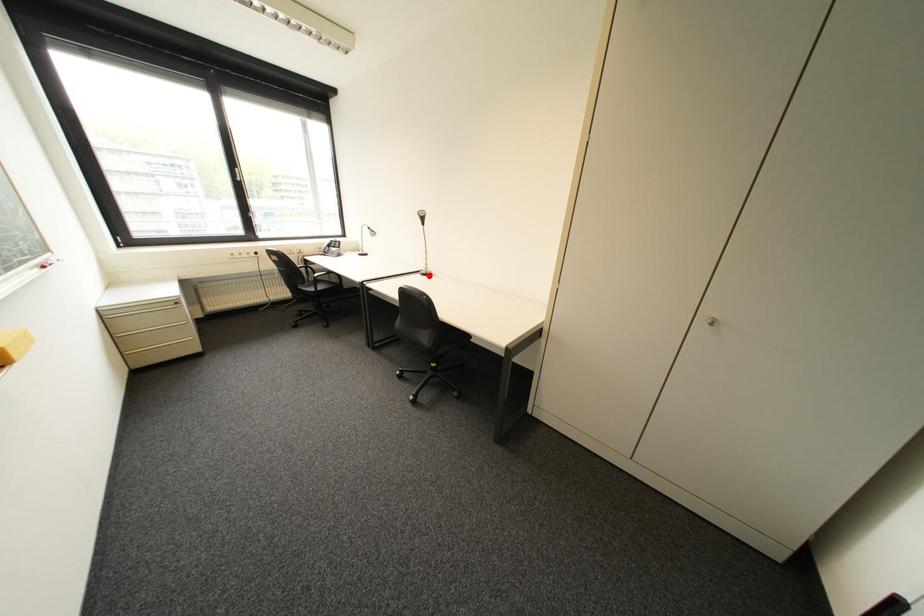
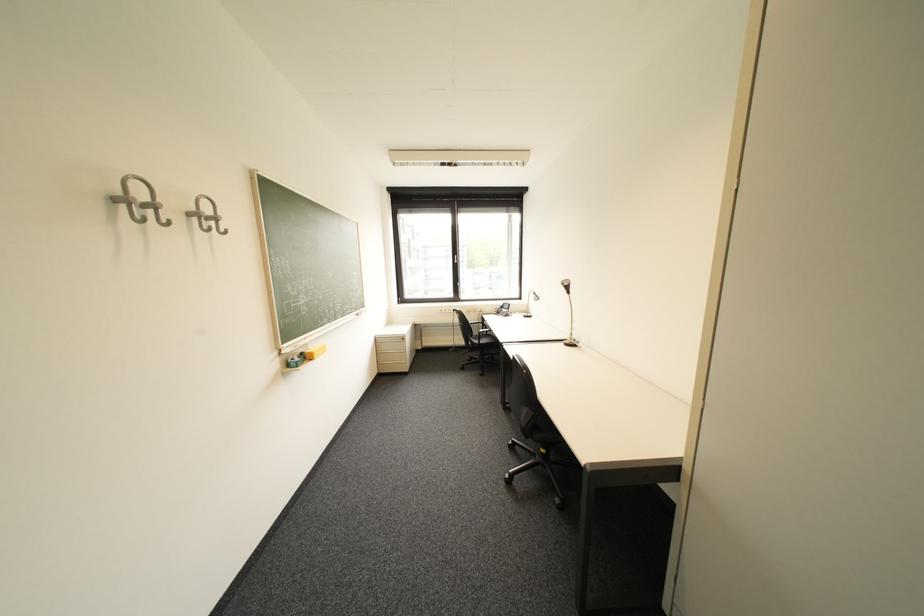
Locate, in the second image, the point that corresponds to the highlighted location in the first image.

(572, 345)